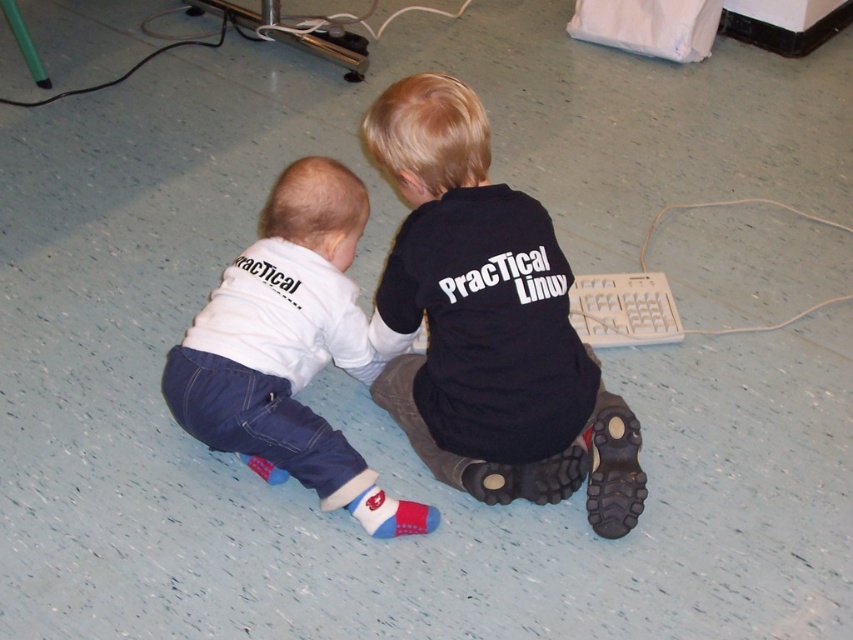
Question: Which point appears farthest from the camera in this image?

Choices:
 (A) (189, 426)
 (B) (480, 477)

Answer: (A)

Question: Which object is farther from the camera taking this photo?

Choices:
 (A) white cotton shirt at lower left
 (B) black matte shirt at center

Answer: (A)

Question: Is black matte shirt at center to the right of white cotton shirt at lower left from the viewer's perspective?

Choices:
 (A) yes
 (B) no

Answer: (A)

Question: Is black matte shirt at center to the left of white cotton shirt at lower left from the viewer's perspective?

Choices:
 (A) yes
 (B) no

Answer: (B)

Question: Which point is farther to the camera?

Choices:
 (A) (364, 371)
 (B) (578, 465)

Answer: (A)

Question: Does black matte shirt at center lie in front of white cotton shirt at lower left?

Choices:
 (A) yes
 (B) no

Answer: (A)